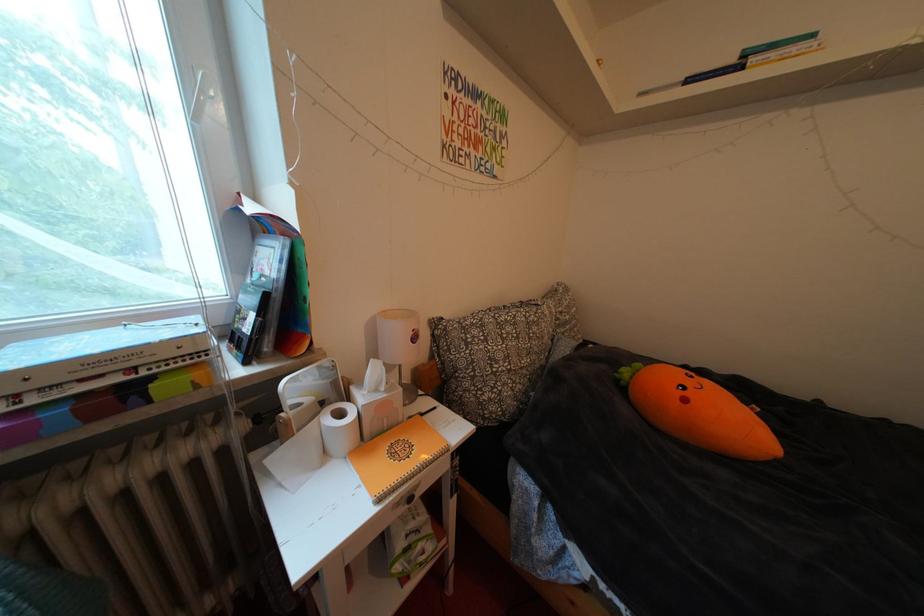
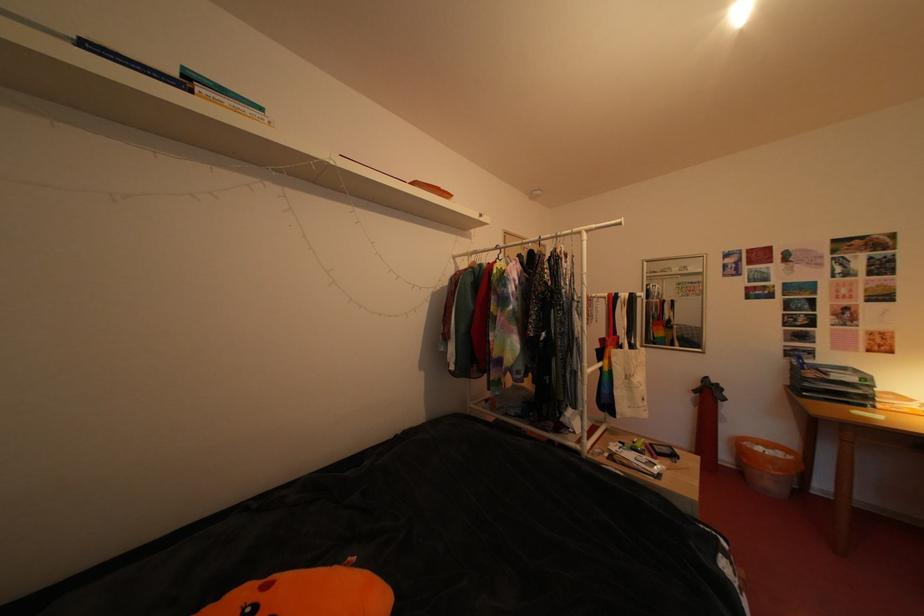
Question: The first image is from the beginning of the video and the second image is from the end. How did the camera likely rotate when shooting the video?

Choices:
 (A) Left
 (B) Right
 (C) Up
 (D) Down

Answer: (B)